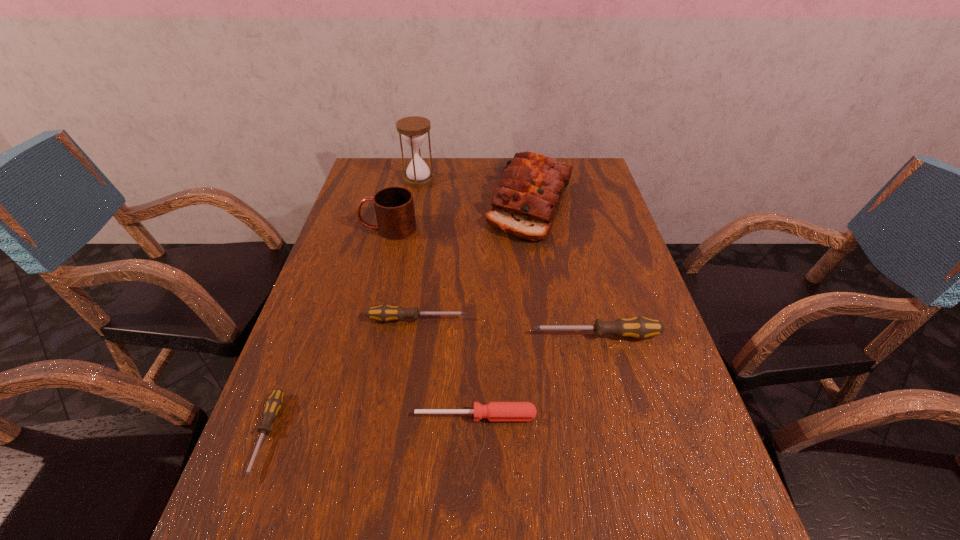
Locate an element on the screen. This screenshot has height=540, width=960. the smallest gray screwdriver is located at coordinates (273, 404).

At what (x,y) coordinates should I click in order to perform the action: click on the leftmost screwdriver. Please return your answer as a coordinate pair (x, y). Looking at the image, I should click on (273, 404).

You are a GUI agent. You are given a task and a screenshot of the screen. Output one action in this format:
    pyautogui.click(x=<x>, y=<y>)
    Task: Click on the vacant space located 0.090m on the right of the white hourglass
    The width and height of the screenshot is (960, 540).
    Given the screenshot: What is the action you would take?
    pyautogui.click(x=461, y=180)

In order to click on free space located 0.120m on the front of the bread in this screenshot , I will do `click(541, 274)`.

Where is `vacant space located 0.060m on the side of the fifth shortest object with the handle`? This screenshot has height=540, width=960. vacant space located 0.060m on the side of the fifth shortest object with the handle is located at coordinates (340, 229).

Find the location of a particular element. Image resolution: width=960 pixels, height=540 pixels. vacant space located 0.370m at the tip of the biggest gray screwdriver is located at coordinates (372, 335).

This screenshot has width=960, height=540. I want to click on free location located 0.180m at the tip of the biggest gray screwdriver, so click(x=454, y=335).

This screenshot has height=540, width=960. I want to click on vacant region located 0.290m at the tip of the biggest gray screwdriver, so pyautogui.click(x=407, y=335).

Locate an element on the screen. This screenshot has width=960, height=540. vacant space situated at the tip of the second gray screwdriver from right to left is located at coordinates (529, 319).

This screenshot has width=960, height=540. What are the coordinates of `vacant space located 0.150m on the back of the red screwdriver` in the screenshot? It's located at (476, 349).